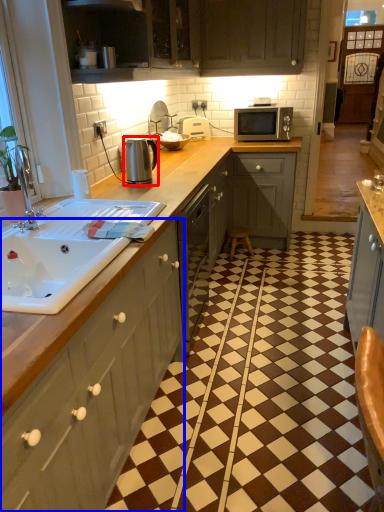
Question: Which point is closer to the camera, appliance (highlighted by a red box) or cabinetry (highlighted by a blue box)?

Choices:
 (A) appliance
 (B) cabinetry

Answer: (B)